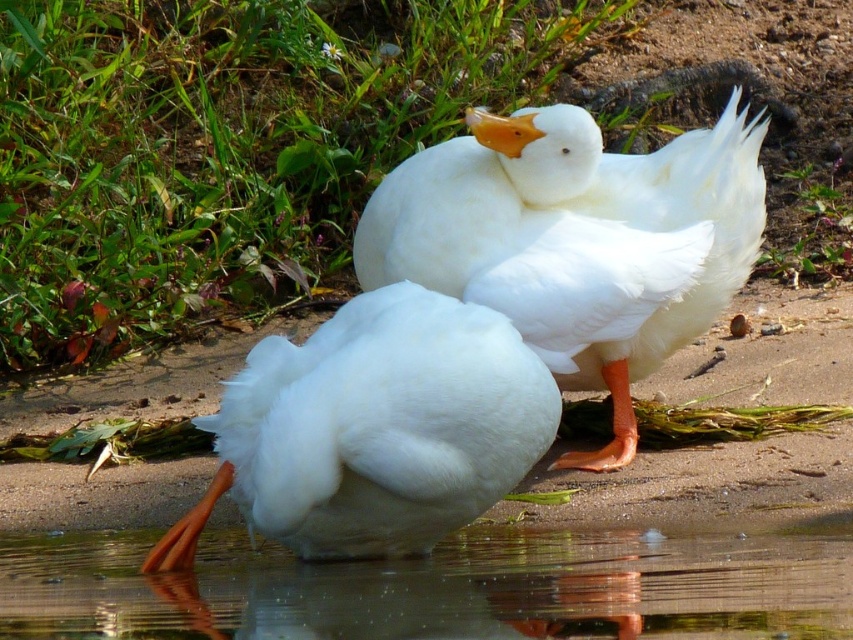
Question: Estimate the real-world distances between objects in this image. Which object is farther from the white fluffy duck at center?

Choices:
 (A) transparent water at lower center
 (B) white fluffy duck at lower left

Answer: (A)

Question: Is transparent water at lower center bigger than white fluffy duck at lower left?

Choices:
 (A) no
 (B) yes

Answer: (A)

Question: Estimate the real-world distances between objects in this image. Which object is closer to the transparent water at lower center?

Choices:
 (A) white fluffy duck at lower left
 (B) white fluffy duck at center

Answer: (A)

Question: Does transparent water at lower center have a greater width compared to white fluffy duck at center?

Choices:
 (A) no
 (B) yes

Answer: (B)

Question: Is transparent water at lower center behind white fluffy duck at center?

Choices:
 (A) yes
 (B) no

Answer: (B)

Question: Among these objects, which one is farthest from the camera?

Choices:
 (A) transparent water at lower center
 (B) white fluffy duck at lower left

Answer: (B)